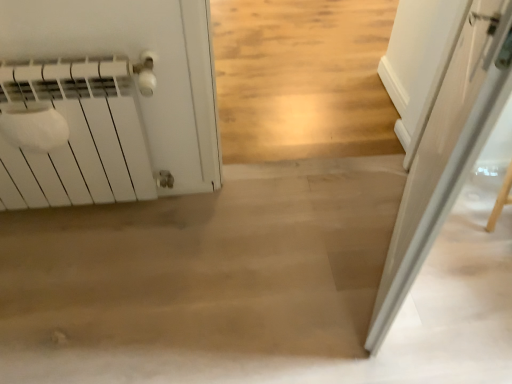
Where is `free spot in front of white glossy door at right`? free spot in front of white glossy door at right is located at coordinates 402,334.